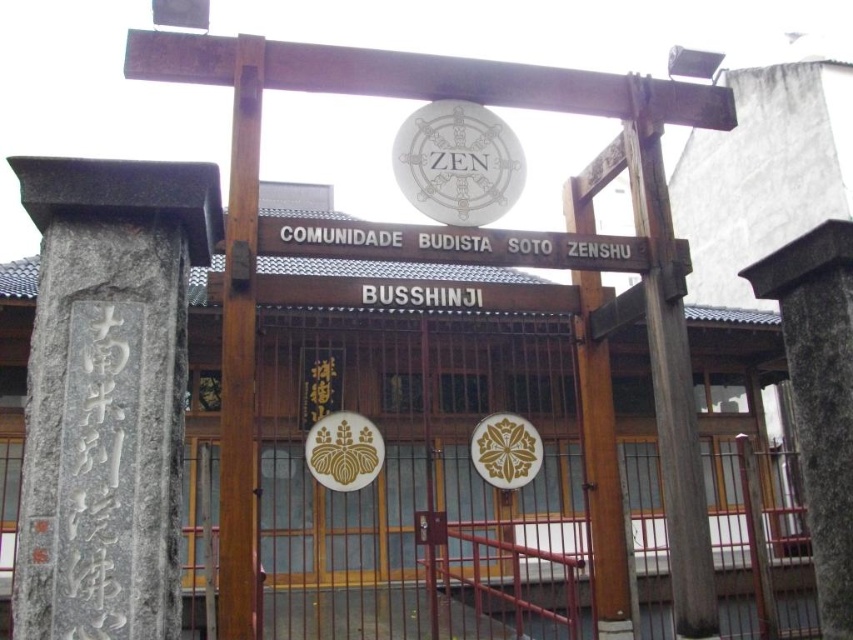
Question: Which object is farther from the camera taking this photo?

Choices:
 (A) gray stone pillar at left
 (B) matte silver disc at center
 (C) wooden post at center

Answer: (B)

Question: Which of the following is the closest to the observer?

Choices:
 (A) white metallic sign at center
 (B) wooden post at center

Answer: (B)

Question: Is wooden post at center bigger than matte silver disc at center?

Choices:
 (A) no
 (B) yes

Answer: (B)

Question: Which point is farther to the camera?

Choices:
 (A) (461, 129)
 (B) (428, 301)

Answer: (A)

Question: Does gray stone pillar at center have a larger size compared to white paper sign at center?

Choices:
 (A) yes
 (B) no

Answer: (A)

Question: Can you confirm if gray stone pillar at center is smaller than white metallic sign at center?

Choices:
 (A) yes
 (B) no

Answer: (B)